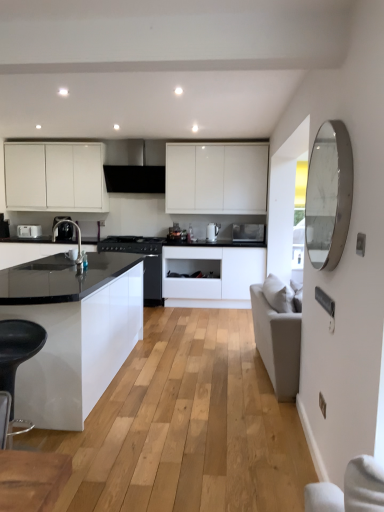
Question: Which direction should I rotate to face metallic silver microwave at center, which is counted as the first appliance, starting from the right, — up or down?

Choices:
 (A) down
 (B) up

Answer: (B)

Question: Considering the relative sizes of silver/metallic mirror at right and black matte stove at center, the first appliance positioned from the left, in the image provided, is silver/metallic mirror at right wider than black matte stove at center, the first appliance positioned from the left,?

Choices:
 (A) no
 (B) yes

Answer: (A)

Question: Is silver/metallic mirror at right to the left of black matte stove at center, arranged as the 3th appliance when viewed from the right, from the viewer's perspective?

Choices:
 (A) no
 (B) yes

Answer: (A)

Question: Is silver/metallic mirror at right far from black matte stove at center, the first appliance positioned from the left?

Choices:
 (A) no
 (B) yes

Answer: (B)

Question: From the image's perspective, would you say silver/metallic mirror at right is shown under black matte stove at center, arranged as the 3th appliance when viewed from the right?

Choices:
 (A) no
 (B) yes

Answer: (A)

Question: Can you confirm if silver/metallic mirror at right is positioned to the right of black matte stove at center, the first appliance positioned from the left?

Choices:
 (A) yes
 (B) no

Answer: (A)

Question: Is silver/metallic mirror at right outside of black matte stove at center, arranged as the 3th appliance when viewed from the right?

Choices:
 (A) yes
 (B) no

Answer: (A)

Question: Is black glossy stove at center outside of matte black sink at center?

Choices:
 (A) yes
 (B) no

Answer: (A)

Question: Is black glossy stove at center to the right of matte black sink at center from the viewer's perspective?

Choices:
 (A) no
 (B) yes

Answer: (B)

Question: From a real-world perspective, is black glossy stove at center physically above matte black sink at center?

Choices:
 (A) yes
 (B) no

Answer: (B)

Question: Is black glossy stove at center further to camera compared to matte black sink at center?

Choices:
 (A) no
 (B) yes

Answer: (B)

Question: From the image's perspective, is black glossy stove at center on matte black sink at center?

Choices:
 (A) no
 (B) yes

Answer: (A)

Question: Is black glossy stove at center placed right next to matte black sink at center?

Choices:
 (A) yes
 (B) no

Answer: (B)

Question: Is silver/metallic mirror at right smaller than matte white toaster at left, which is counted as the second kitchen appliance, starting from the right?

Choices:
 (A) no
 (B) yes

Answer: (A)